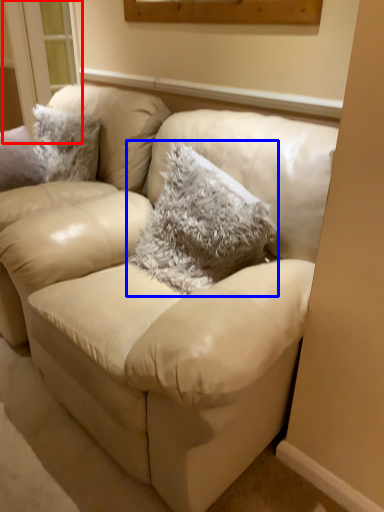
Question: Which object is further to the camera taking this photo, window (highlighted by a red box) or throw pillow (highlighted by a blue box)?

Choices:
 (A) window
 (B) throw pillow

Answer: (A)